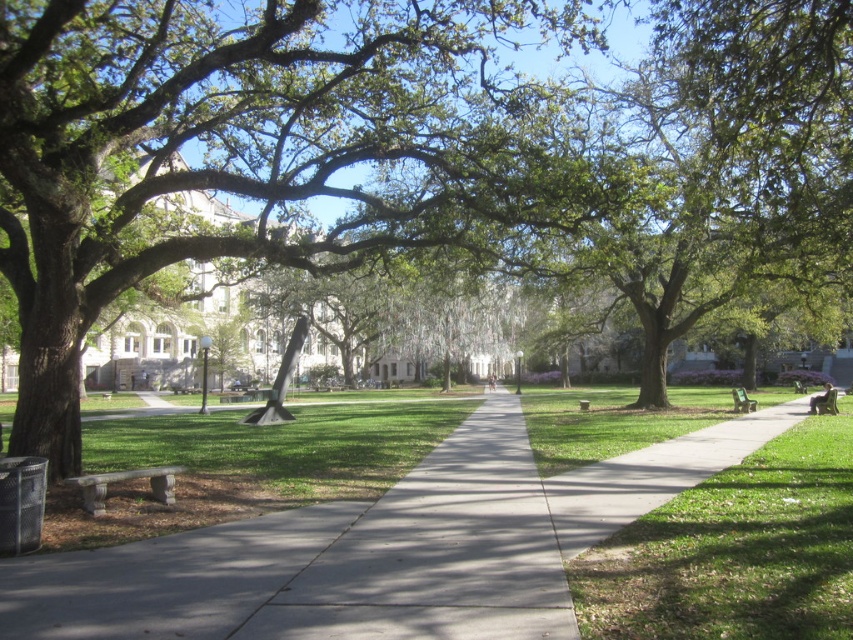
Question: Observing the image, what is the correct spatial positioning of stone bench at lower left in reference to green stone bench at center?

Choices:
 (A) right
 (B) left

Answer: (B)

Question: Which object is positioned closest to the green stone bench at center?

Choices:
 (A) green leafy tree at center
 (B) green wooden bench at right

Answer: (B)

Question: Which point is farther to the camera?

Choices:
 (A) pos(647,627)
 (B) pos(732,396)
 (C) pos(193,77)

Answer: (B)

Question: Is green grass at center further to camera compared to green wooden bench at right?

Choices:
 (A) no
 (B) yes

Answer: (A)

Question: Does green grass at center appear on the left side of green wooden bench at right?

Choices:
 (A) no
 (B) yes

Answer: (B)

Question: Among these points, which one is farthest from the camera?

Choices:
 (A) (107, 477)
 (B) (815, 403)

Answer: (B)